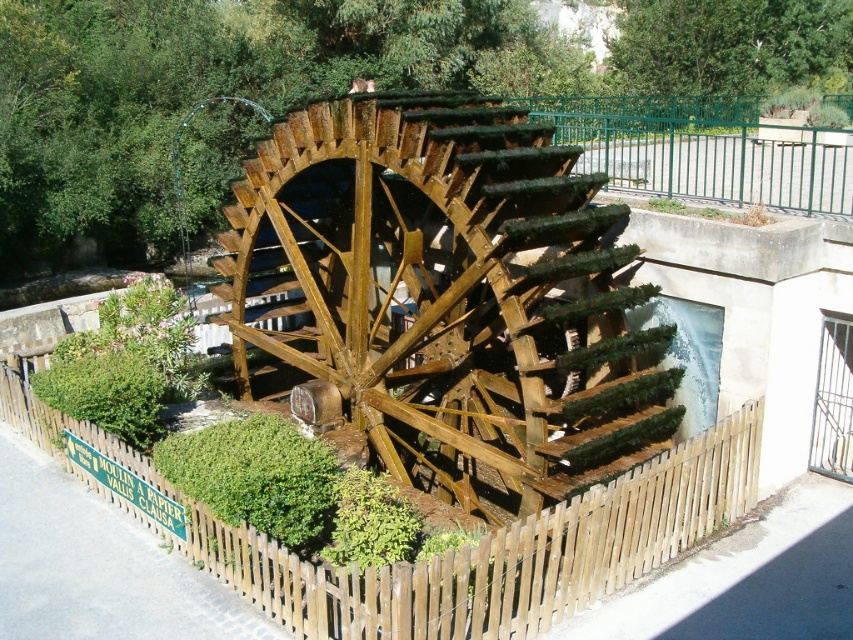
You are a tour guide leading a group to the wooden waterwheel at center. You need to inform them how far they need to walk from the brown wooden fence at lower center to reach the waterwheel. What distance should you mention?

The wooden waterwheel at center is 13.59 feet away from the brown wooden fence at lower center, so the tour guide should mention that the distance is 13.59 feet.

You are standing in front of the wooden waterwheel at center and want to take a photo of it from a distance that is exactly 32 feet away. Is your current position suitable for this?

The distance between you and the wooden waterwheel at center is 31.99 feet, which is very close to 32 feet. Therefore, your current position is suitable for taking the photo from approximately 32 feet away.

You are standing in front of the wooden waterwheel at center. If you walk straight ahead, will you eventually reach the fence?

The wooden waterwheel at center is located at the center of the image, and the fence surrounds it, so walking straight ahead would lead you towards the fence.